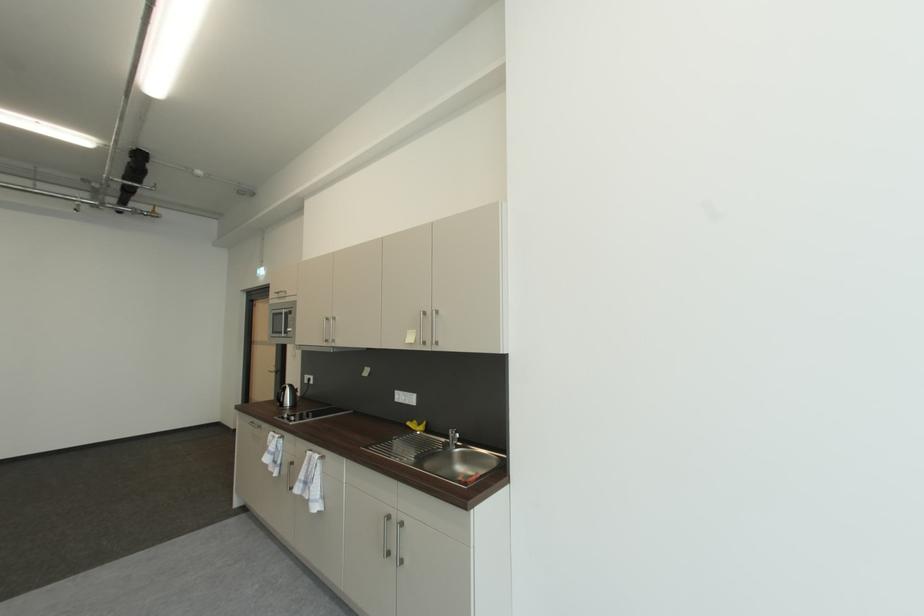
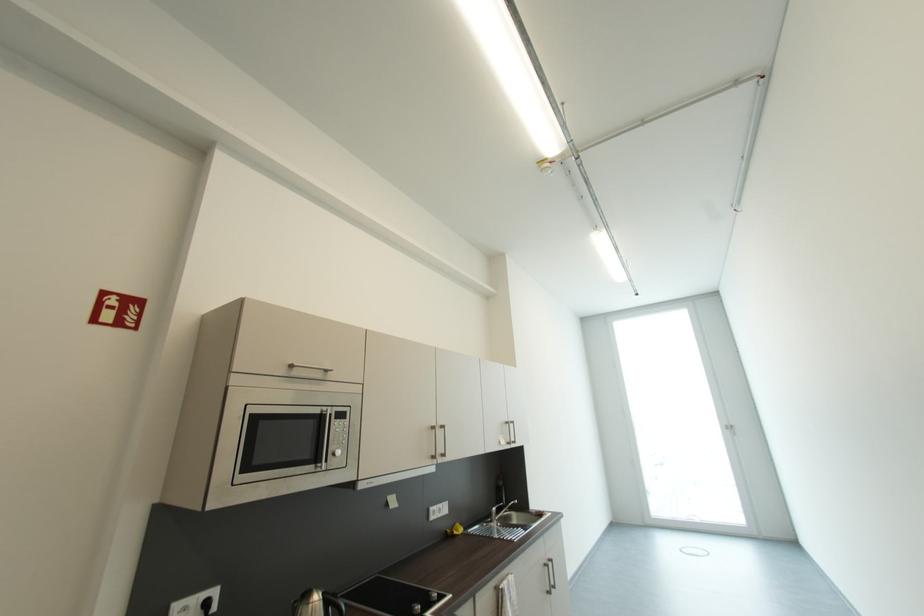
Find the pixel in the second image that matches the point at 419,423 in the first image.

(454, 533)